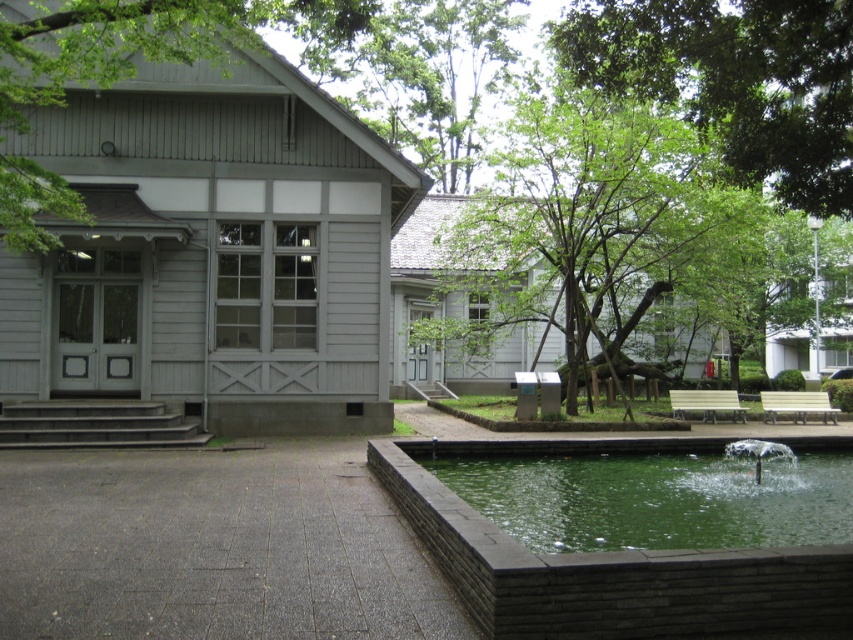
You are a landscape architect designing a new pathway between the green leafy tree at center and the green stone water at lower right. Based on their sizes, which object should you consider placing closer to the entrance for better visibility?

The green leafy tree at center might be wider than green stone water at lower right, so it should be placed closer to the entrance to ensure it doesn not block the view of the smaller water feature.

You are a landscape architect designing a walking path between the green leafy tree at upper center and the green stone water at lower right. The path must be exactly 5 meters long. Can you create such a path between them?

The distance between the green leafy tree at upper center and the green stone water at lower right is 5.10 meters. Since the required path length is 5 meters, which is slightly shorter than the actual distance, you cannot create a path of exactly 5 meters between them.